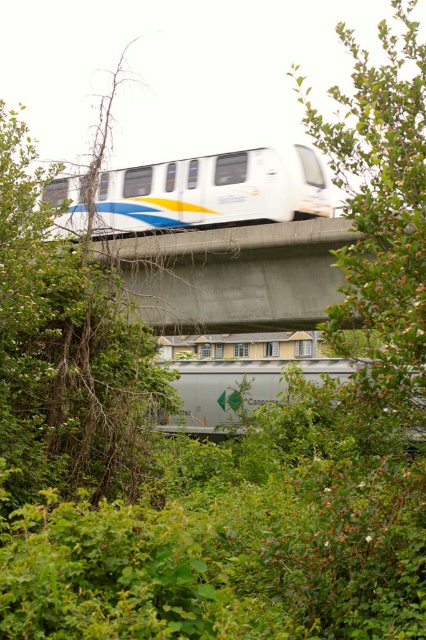
Who is shorter, concrete at center or silver/grey metallic freight car at center?

concrete at center

Is point (310, 326) more distant than point (181, 422)?

No, it is not.

Which is behind, point (203, 280) or point (249, 374)?

Point (249, 374)

This screenshot has height=640, width=426. I want to click on concrete at center, so click(235, 275).

Is point (417, 388) positioned in front of point (175, 420)?

Yes, point (417, 388) is in front of point (175, 420).

Who is positioned more to the right, green leafy tree at upper right or silver/grey metallic freight car at center?

From the viewer's perspective, green leafy tree at upper right appears more on the right side.

Is point (405, 168) more distant than point (242, 369)?

No, it is not.

The height and width of the screenshot is (640, 426). I want to click on green leafy tree at upper right, so click(x=382, y=214).

Can you confirm if green leafy tree at left is positioned to the left of white glossy monorail at center?

Correct, you'll find green leafy tree at left to the left of white glossy monorail at center.

Is point (0, 106) closer to viewer compared to point (158, 208)?

That is True.

The image size is (426, 640). What are the coordinates of `green leafy tree at left` in the screenshot? It's located at (66, 349).